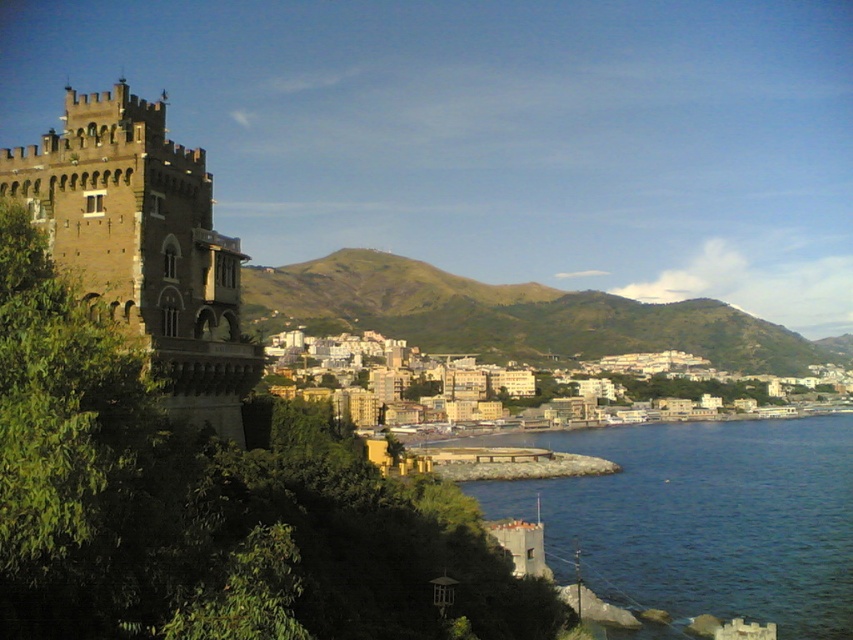
Question: Is blue liquid water at lower right closer to the viewer compared to beige concrete buildings at center?

Choices:
 (A) no
 (B) yes

Answer: (B)

Question: Can you confirm if blue liquid water at lower right is smaller than beige concrete buildings at center?

Choices:
 (A) yes
 (B) no

Answer: (A)

Question: Which point appears closest to the camera in this image?

Choices:
 (A) (227, 365)
 (B) (793, 364)
 (C) (688, 525)
 (D) (786, 413)

Answer: (A)

Question: Which point is closer to the camera?

Choices:
 (A) brown stone tower at left
 (B) blue liquid water at lower right
 (C) green grassy hillside at center
 (D) beige concrete buildings at center

Answer: (A)

Question: Is blue liquid water at lower right closer to camera compared to brown stone tower at left?

Choices:
 (A) yes
 (B) no

Answer: (B)

Question: Which object is closer to the camera taking this photo?

Choices:
 (A) green grassy hillside at center
 (B) brown stone tower at left
 (C) beige concrete buildings at center
 (D) blue liquid water at lower right

Answer: (B)